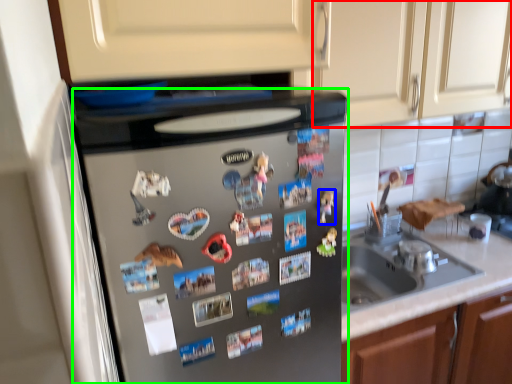
Question: Which object is positioned farthest from cabinetry (highlighted by a red box)? Select from toy (highlighted by a blue box) and home appliance (highlighted by a green box).

Choices:
 (A) toy
 (B) home appliance

Answer: (A)